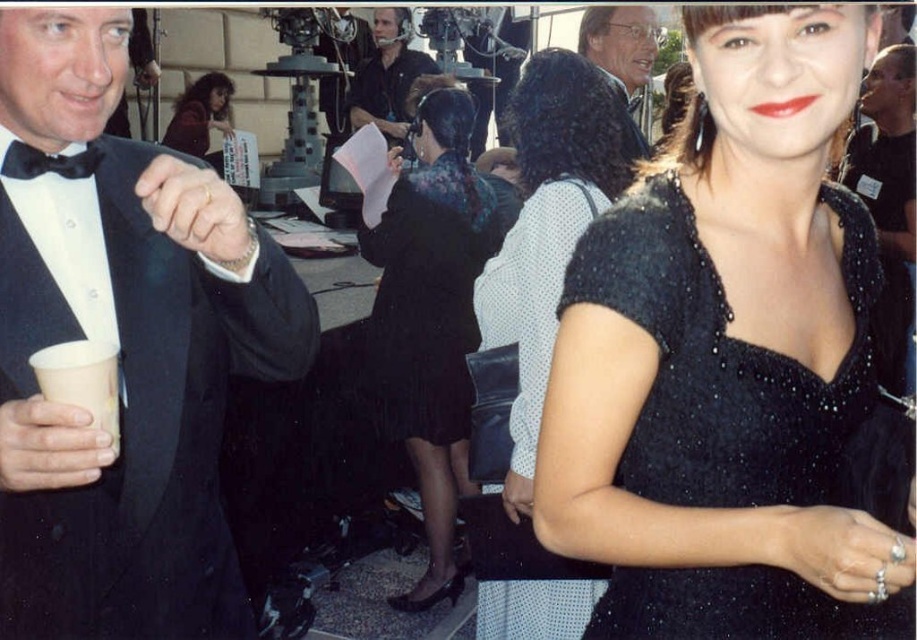
You are at a social event and need to grab your drink and your headset quickly. The matte black headset at center and the white paper cup at left are both on a table. Can you reach both items without moving your chair?

The distance between the matte black headset at center and the white paper cup at left is 13.55 feet, which is quite far. You would need to move your chair to reach both items.

Consider the image. You are at the event and want to find the black satin tuxedo at left. Based on the coordinates provided, where should you look to locate it?

The black satin tuxedo at left is located at coordinates point (123, 353).